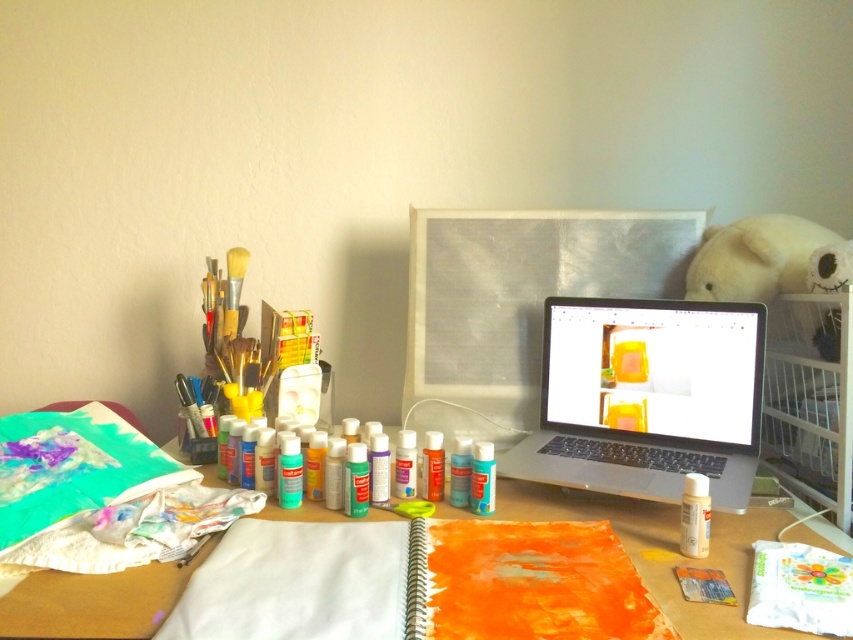
Who is higher up, metallic silver monitor at center or matte orange paper at center?

Positioned higher is metallic silver monitor at center.

Is metallic silver monitor at center thinner than matte orange paper at center?

Yes, metallic silver monitor at center is thinner than matte orange paper at center.

This screenshot has width=853, height=640. What do you see at coordinates (517, 301) in the screenshot?
I see `metallic silver monitor at center` at bounding box center [517, 301].

What are the coordinates of `metallic silver monitor at center` in the screenshot? It's located at (517, 301).

Between silver metallic laptop at center and metallic silver monitor at center, which one appears on the left side from the viewer's perspective?

metallic silver monitor at center is more to the left.

Between silver metallic laptop at center and metallic silver monitor at center, which one has more height?

Answer: metallic silver monitor at center

Find the location of `silver metallic laptop at center`. silver metallic laptop at center is located at coordinates (647, 397).

Does silver metallic laptop at center have a smaller size compared to matte orange paper at center?

Correct, silver metallic laptop at center occupies less space than matte orange paper at center.

Measure the distance between silver metallic laptop at center and matte orange paper at center.

silver metallic laptop at center is 7.16 inches from matte orange paper at center.

Who is more forward, (718,481) or (28,612)?

Point (28,612) is more forward.

The height and width of the screenshot is (640, 853). Identify the location of silver metallic laptop at center. (647, 397).